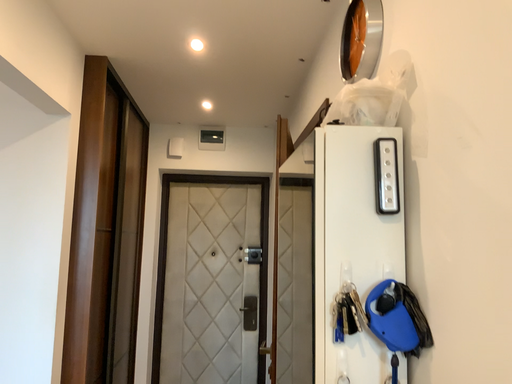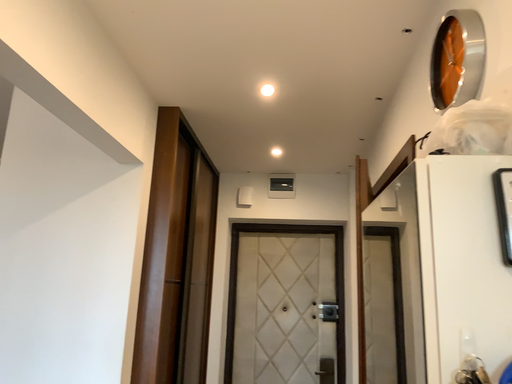
Question: Which way did the camera rotate in the video?

Choices:
 (A) rotated downward
 (B) rotated upward

Answer: (B)